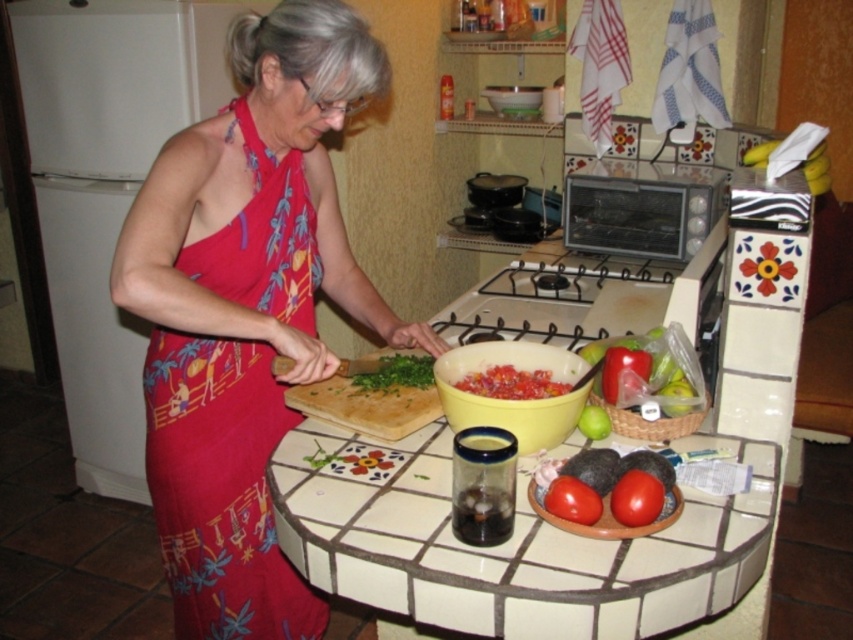
You are a chef preparing a dish and need to place a red matte tomato at center on the white tile countertop at center. Can you fit the tomato on the countertop without it hanging over the edge?

The white tile countertop at center is larger in size than the red matte tomato at center, so yes, the tomato can be placed on the countertop without hanging over the edge.

You are a chef in a busy kitchen. You need to place a heavy pot on the wooden at center and the smooth red tomato at lower right. Which object can support the pot without breaking?

The wooden at center can support the pot because it has a larger size compared to the smooth red tomato at lower right, making it more stable and capable of bearing weight.